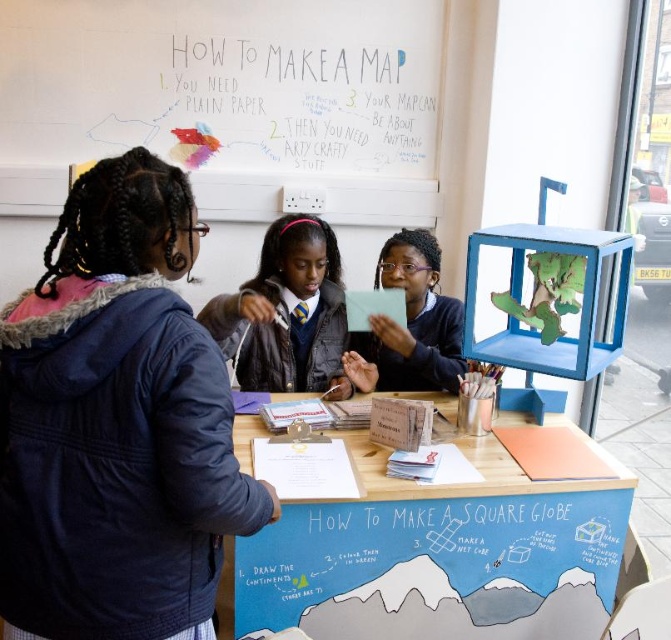
Is matte black jacket at center above matte black tablet at center?

Actually, matte black jacket at center is below matte black tablet at center.

How much distance is there between matte black jacket at center and matte black tablet at center?

The distance of matte black jacket at center from matte black tablet at center is 11.11 inches.

Where is `matte black jacket at center`? The image size is (671, 640). matte black jacket at center is located at coordinates (287, 314).

Does wooden table at center have a lesser width compared to matte black jacket at center?

In fact, wooden table at center might be wider than matte black jacket at center.

Who is shorter, wooden table at center or matte black jacket at center?

matte black jacket at center is shorter.

Which is behind, point (550, 500) or point (260, 316)?

Point (260, 316)

The image size is (671, 640). In order to click on wooden table at center in this screenshot , I will do `click(435, 556)`.

Does navy blue jacket at left appear on the right side of matte black jacket at center?

In fact, navy blue jacket at left is to the left of matte black jacket at center.

Who is more distant from viewer, (46, 496) or (285, 276)?

The point (285, 276) is more distant.

Where is `navy blue jacket at left`? The height and width of the screenshot is (640, 671). navy blue jacket at left is located at coordinates (115, 422).